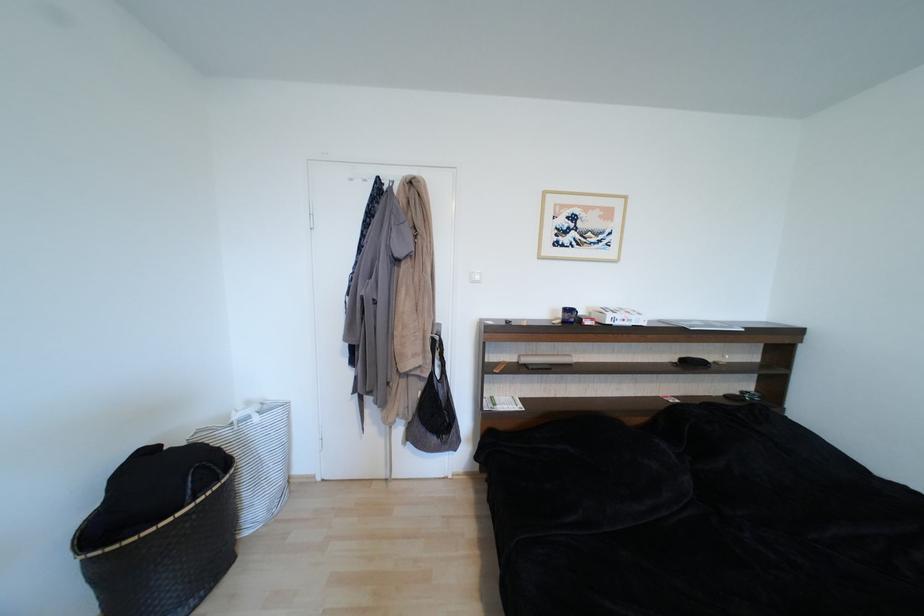
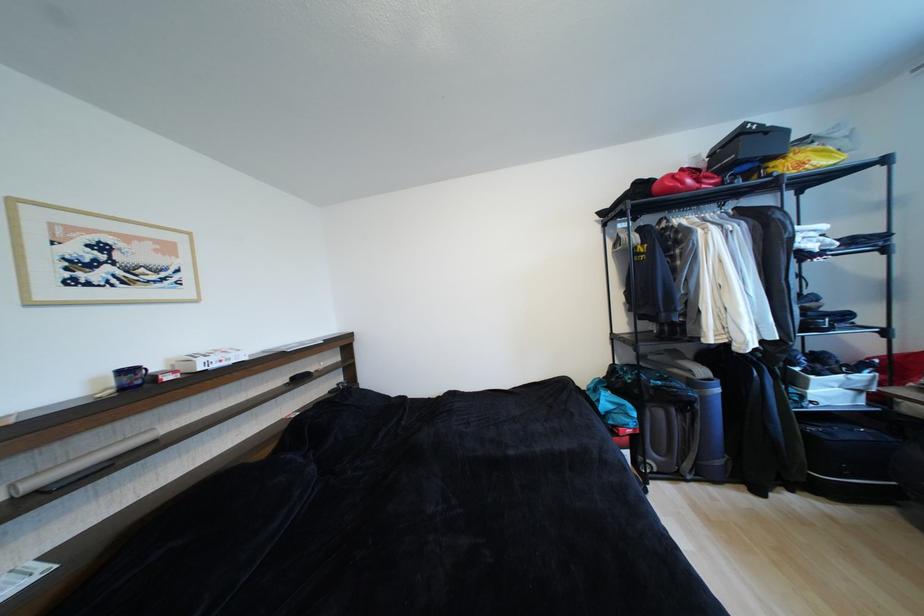
The point at (531, 361) is marked in the first image. Where is the corresponding point in the second image?

(40, 485)